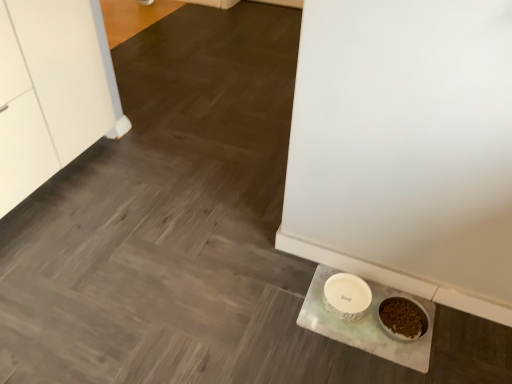
Question: Is white speckled ceramic bowl at lower right at the right side of white marble slate at lower right?

Choices:
 (A) yes
 (B) no

Answer: (B)

Question: From the image's perspective, is white speckled ceramic bowl at lower right under white marble slate at lower right?

Choices:
 (A) no
 (B) yes

Answer: (A)

Question: Is white speckled ceramic bowl at lower right shorter than white marble slate at lower right?

Choices:
 (A) yes
 (B) no

Answer: (B)

Question: From a real-world perspective, is white speckled ceramic bowl at lower right on top of white marble slate at lower right?

Choices:
 (A) no
 (B) yes

Answer: (B)

Question: Is white speckled ceramic bowl at lower right turned away from white marble slate at lower right?

Choices:
 (A) no
 (B) yes

Answer: (A)

Question: Considering the relative sizes of white speckled ceramic bowl at lower right and white marble slate at lower right in the image provided, is white speckled ceramic bowl at lower right thinner than white marble slate at lower right?

Choices:
 (A) no
 (B) yes

Answer: (B)

Question: From a real-world perspective, is white marble slate at lower right physically below white speckled ceramic bowl at lower right?

Choices:
 (A) no
 (B) yes

Answer: (B)

Question: Considering the relative positions of white marble slate at lower right and white speckled ceramic bowl at lower right in the image provided, is white marble slate at lower right to the left of white speckled ceramic bowl at lower right from the viewer's perspective?

Choices:
 (A) no
 (B) yes

Answer: (A)

Question: Can you confirm if white marble slate at lower right is smaller than white speckled ceramic bowl at lower right?

Choices:
 (A) no
 (B) yes

Answer: (A)

Question: Does white marble slate at lower right have a greater width compared to white speckled ceramic bowl at lower right?

Choices:
 (A) yes
 (B) no

Answer: (A)

Question: From the image's perspective, is white marble slate at lower right under white speckled ceramic bowl at lower right?

Choices:
 (A) no
 (B) yes

Answer: (B)

Question: Considering the relative sizes of white marble slate at lower right and white speckled ceramic bowl at lower right in the image provided, is white marble slate at lower right shorter than white speckled ceramic bowl at lower right?

Choices:
 (A) no
 (B) yes

Answer: (B)

Question: Looking at their shapes, would you say white speckled ceramic bowl at lower right is wider or thinner than white marble slate at lower right?

Choices:
 (A) wide
 (B) thin

Answer: (B)